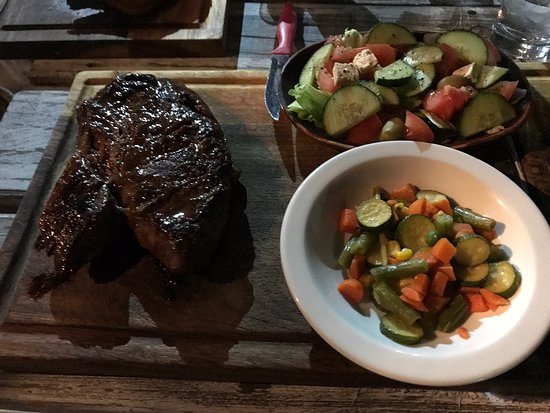
The width and height of the screenshot is (550, 413). In order to click on tray in this screenshot , I will do `click(267, 159)`.